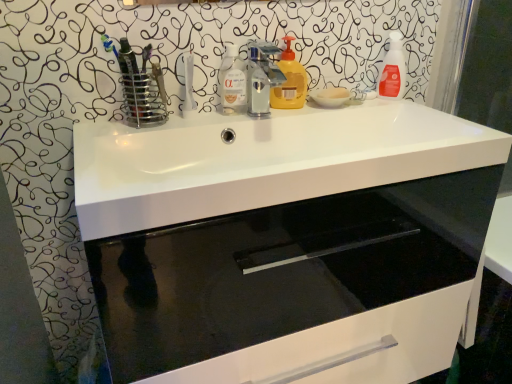
Locate an element on the screen. Image resolution: width=512 pixels, height=384 pixels. free space in front of yellow matte liquid soap at center, marked as the second cleaning product in a left-to-right arrangement is located at coordinates (284, 114).